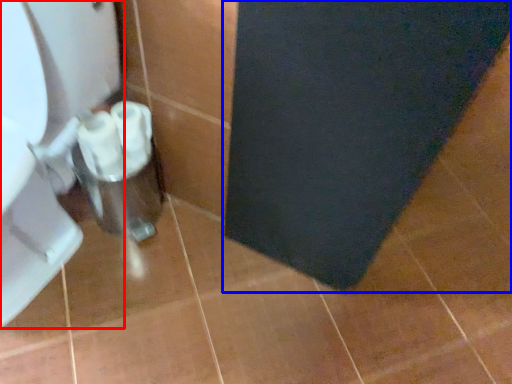
Question: Which point is further to the camera, toilet (highlighted by a red box) or bath mat (highlighted by a blue box)?

Choices:
 (A) toilet
 (B) bath mat

Answer: (B)